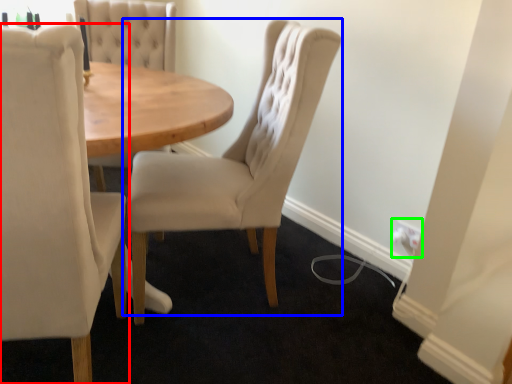
Question: Which object is the farthest from chair (highlighted by a red box)? Choose among these: chair (highlighted by a blue box) or electric outlet (highlighted by a green box).

Choices:
 (A) chair
 (B) electric outlet

Answer: (B)